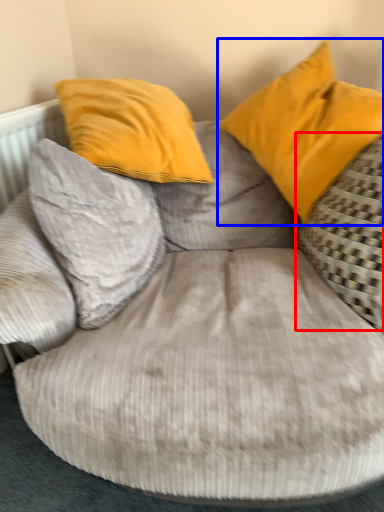
Question: Which object appears closest to the camera in this image, pillow (highlighted by a red box) or pillow (highlighted by a blue box)?

Choices:
 (A) pillow
 (B) pillow

Answer: (A)